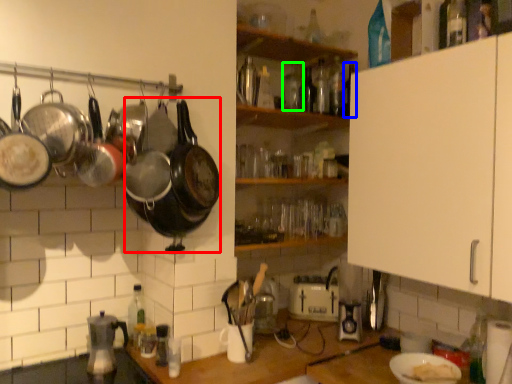
Question: Based on their relative distances, which object is farther from wok (highlighted by a red box)? Choose from bottle (highlighted by a blue box) and bottle (highlighted by a green box).

Choices:
 (A) bottle
 (B) bottle

Answer: (A)